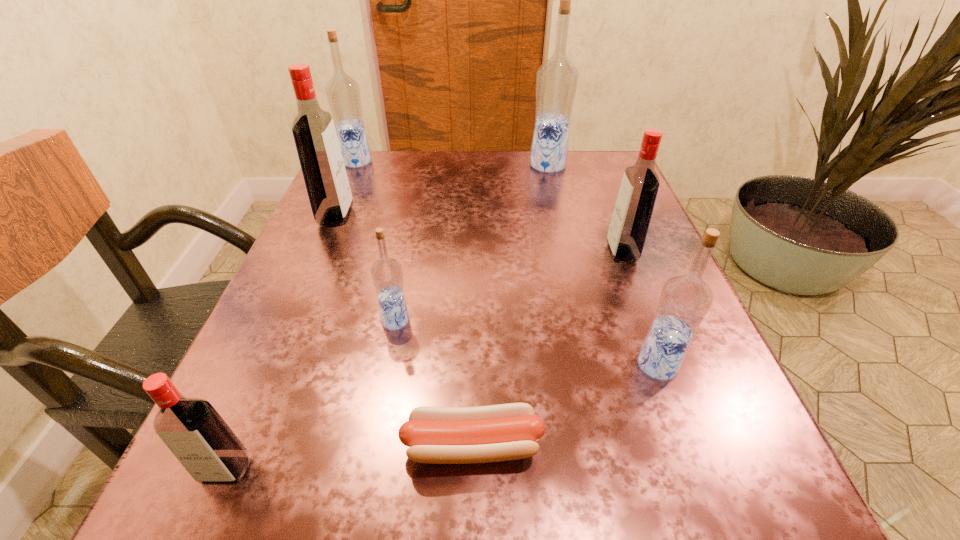
You are a GUI agent. You are given a task and a screenshot of the screen. Output one action in this format:
    pyautogui.click(x=<x>, y=<y>)
    Task: Click on the vacant area that lies between the farthest red vodka and the second blue vodka from right to left
    
    Given the screenshot: What is the action you would take?
    pyautogui.click(x=442, y=191)

Image resolution: width=960 pixels, height=540 pixels. What are the coordinates of `free space that is in between the sausage and the tallest object` in the screenshot? It's located at (510, 306).

Where is `free space between the shortest object and the second biggest blue vodka`? This screenshot has height=540, width=960. free space between the shortest object and the second biggest blue vodka is located at coordinates (415, 304).

Identify which object is the third closest to the third vodka from right to left. Please provide its 2D coordinates. Your answer should be formatted as a tuple, i.e. [(x, y)], where the tuple contains the x and y coordinates of a point satisfying the conditions above.

[(313, 129)]

Select which object appears as the fourth closest to the third smallest blue vodka. Please provide its 2D coordinates. Your answer should be formatted as a tuple, i.e. [(x, y)], where the tuple contains the x and y coordinates of a point satisfying the conditions above.

[(631, 217)]

The image size is (960, 540). Find the location of `vodka that is the third closest one to the fourth nearest object`. vodka that is the third closest one to the fourth nearest object is located at coordinates (685, 299).

Locate an element on the screen. the closest vodka to the smallest red vodka is located at coordinates (387, 276).

You are a GUI agent. You are given a task and a screenshot of the screen. Output one action in this format:
    pyautogui.click(x=<x>, y=<y>)
    Task: Click on the blue vodka that can be found as the second closest to the fifth nearest vodka
    Image resolution: width=960 pixels, height=540 pixels.
    Given the screenshot: What is the action you would take?
    pyautogui.click(x=387, y=276)

Locate which blue vodka ranks in proximity to the rightmost red vodka. Please provide its 2D coordinates. Your answer should be formatted as a tuple, i.e. [(x, y)], where the tuple contains the x and y coordinates of a point satisfying the conditions above.

[(685, 299)]

Locate which red vodka ranks in proximity to the third object from right to left. Please provide its 2D coordinates. Your answer should be formatted as a tuple, i.e. [(x, y)], where the tuple contains the x and y coordinates of a point satisfying the conditions above.

[(631, 217)]